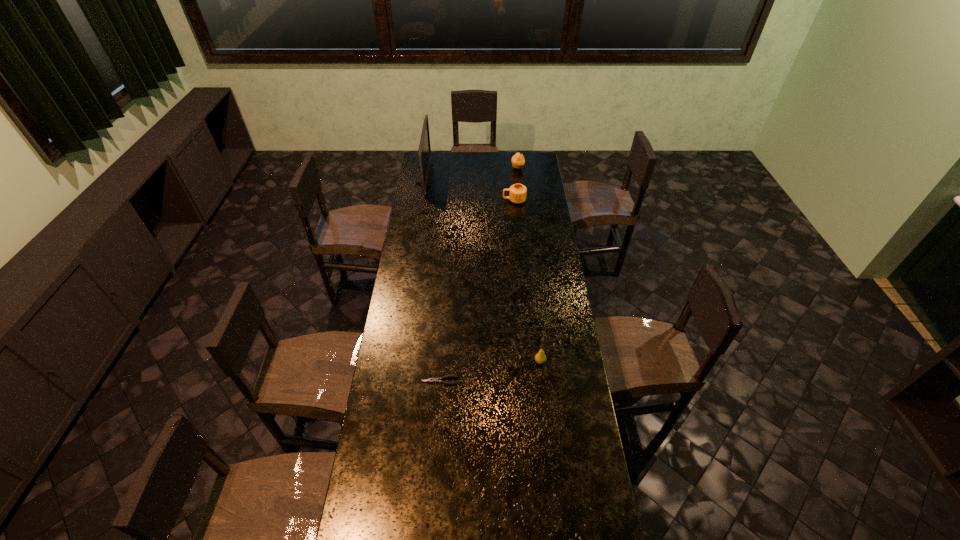
Find the location of a particular element. object that is at the far left corner is located at coordinates (424, 173).

Find the location of a particular element. This screenshot has width=960, height=540. object that is positioned at the far right corner is located at coordinates (518, 161).

In the image, there is a desktop. Find the location of `vacant space at the left edge`. vacant space at the left edge is located at coordinates (404, 397).

Find the location of `vacant space at the right edge`. vacant space at the right edge is located at coordinates tap(555, 296).

Where is `vacant space at the far right corner`? vacant space at the far right corner is located at coordinates (527, 170).

This screenshot has height=540, width=960. Find the location of `free space between the farther pear and the monitor`. free space between the farther pear and the monitor is located at coordinates (471, 172).

Find the location of `free spot between the second object from left to right and the fourth farthest object`. free spot between the second object from left to right and the fourth farthest object is located at coordinates (490, 372).

Where is `free space between the mug and the leftmost object`? free space between the mug and the leftmost object is located at coordinates (469, 188).

Find the location of a particular element. This screenshot has height=540, width=960. free space between the tallest object and the mug is located at coordinates [x=469, y=188].

I want to click on free space between the second object from left to right and the tallest object, so click(x=432, y=279).